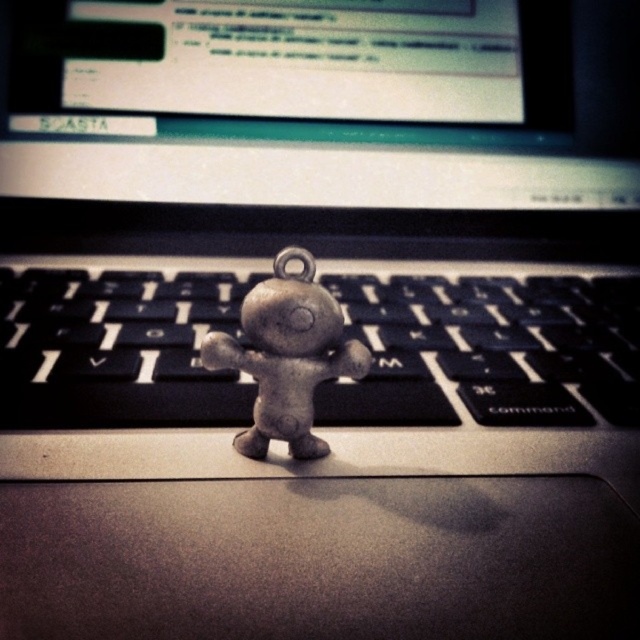
Question: Is black matte keyboard at center thinner than metallic figure at center?

Choices:
 (A) no
 (B) yes

Answer: (A)

Question: Does black matte keyboard at center have a greater width compared to metallic figure at center?

Choices:
 (A) yes
 (B) no

Answer: (A)

Question: Is black matte keyboard at center to the right of metallic figure at center from the viewer's perspective?

Choices:
 (A) no
 (B) yes

Answer: (B)

Question: Which object is farther from the camera taking this photo?

Choices:
 (A) metallic figure at center
 (B) black matte keyboard at center

Answer: (B)

Question: Which point appears closest to the camera in this image?

Choices:
 (A) click(x=257, y=273)
 (B) click(x=291, y=316)

Answer: (B)